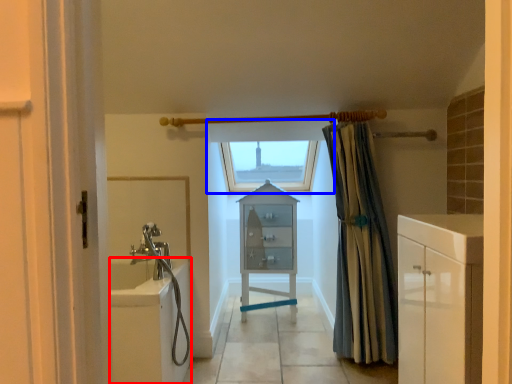
Question: Which object appears closest to the camera in this image, bath (highlighted by a red box) or window (highlighted by a blue box)?

Choices:
 (A) bath
 (B) window

Answer: (A)